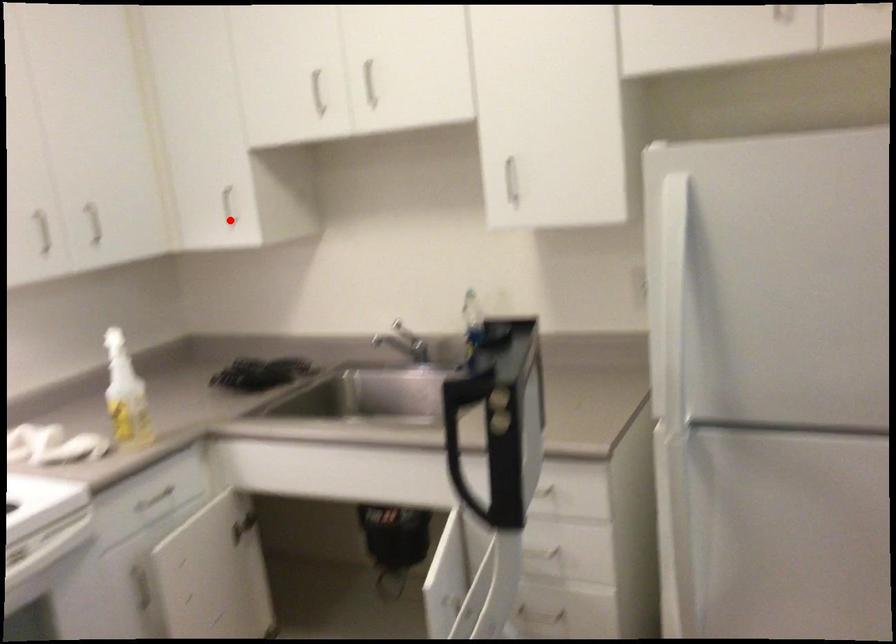
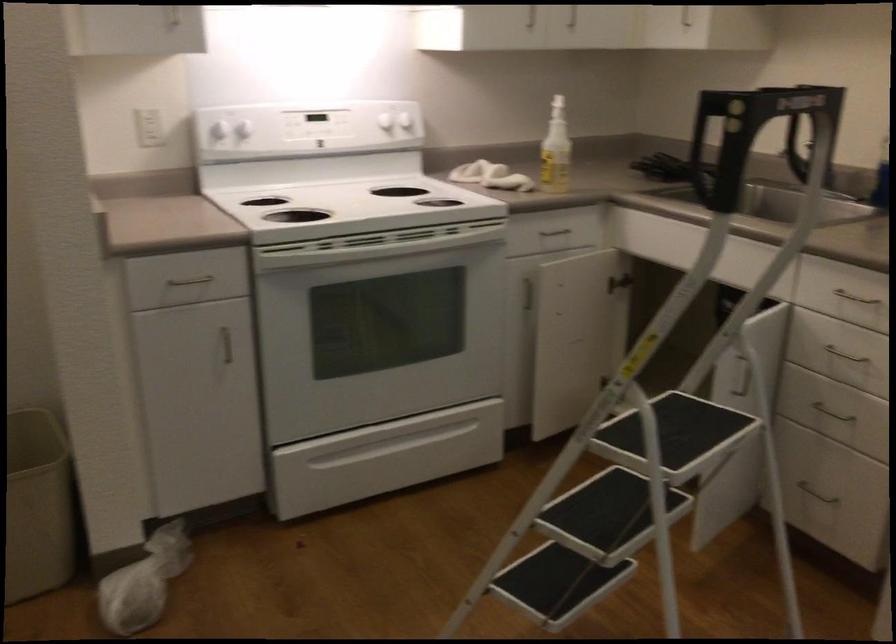
Question: I am providing you with two images of the same scene from different viewpoints. A red point is shown in image1. For the corresponding object point in image2, is it positioned nearer or farther from the camera?

Choices:
 (A) Nearer
 (B) Farther

Answer: (B)